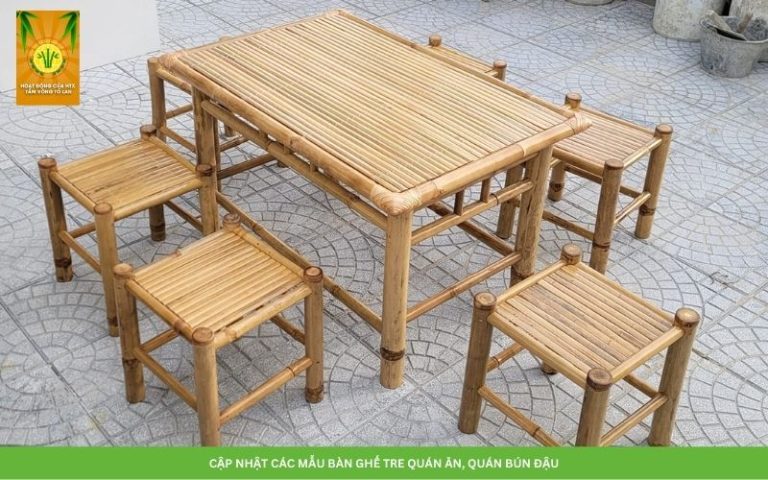
This screenshot has height=480, width=768. Identify the location of gray tiles. (720, 180).